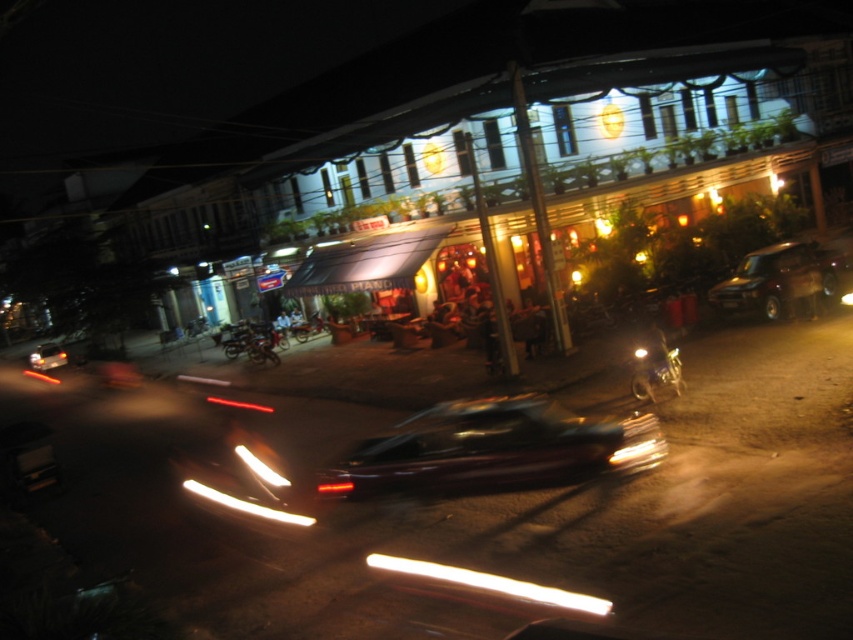
Question: Which point appears closest to the camera in this image?

Choices:
 (A) (730, 289)
 (B) (490, 579)
 (C) (648, 388)
 (D) (346, 488)

Answer: (B)

Question: Which object is the closest to the metallic silver motorcycle at center-right?

Choices:
 (A) shiny dark car at center
 (B) shiny silver car at lower left
 (C) shiny chrome motorcycle at center-left

Answer: (A)

Question: Can you confirm if white fluorescent tube at center is positioned above shiny silver car at lower left?

Choices:
 (A) no
 (B) yes

Answer: (A)

Question: Does dark matte van at right appear on the left side of metallic silver motorcycle at center-right?

Choices:
 (A) no
 (B) yes

Answer: (A)

Question: Does white fluorescent tube at center appear on the left side of shiny chrome motorcycle at center-left?

Choices:
 (A) no
 (B) yes

Answer: (A)

Question: Which object is the farthest from the white fluorescent tube at center?

Choices:
 (A) dark matte van at right
 (B) shiny chrome motorcycle at center-left
 (C) shiny silver car at lower left

Answer: (C)